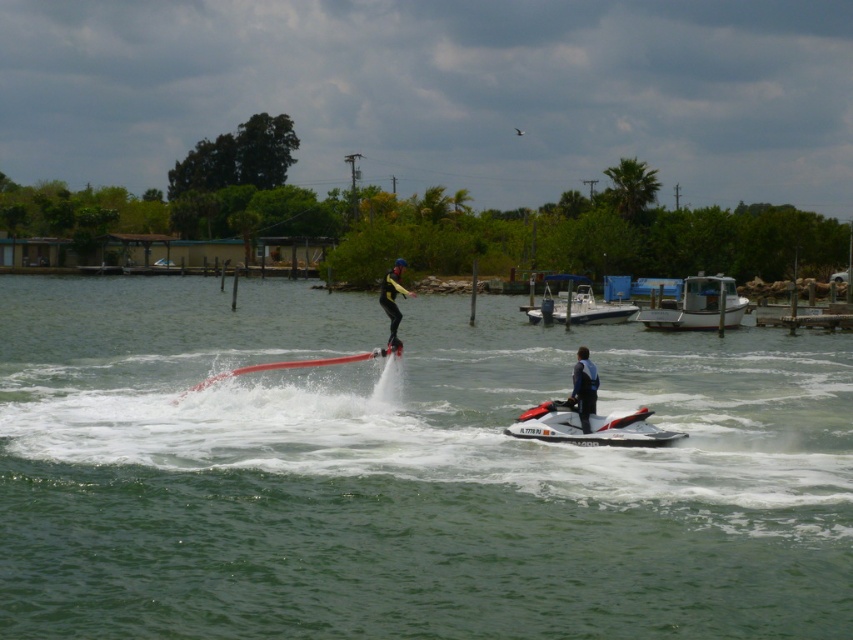
You are a photographer trying to capture the jet skier and the boat in the same frame. Based on the scene, which object should you focus on first to ensure both the white matte boat at right and the yellow matte wetsuit at center are in your shot?

You should focus on the yellow matte wetsuit at center first because the white matte boat at right is positioned to its right side, so centering the yellow matte wetsuit at center will allow the boat to be captured in the frame as well.

You are a photographer standing at the camera position. You want to capture a photo of the white matte boat at right. The boat is 45.16 meters away from you. Your camera has a maximum zoom range of 40 meters. Can you clearly capture the boat without moving closer?

The white matte boat at right is 45.16 meters away from the camera, which exceeds the camera maximum zoom range of 40 meters. Therefore, you cannot clearly capture the boat without moving closer.

You are a drone operator trying to capture a photo of the jet skier performing a trick. The drone is currently at a position where the point at coordinates point (697, 304) is visible. What is the minimum distance the drone must descend to ensure the jet skier is in focus, given the camera has a depth of field of 5 meters?

The point at coordinates point (697, 304) is 49.99 meters away from the camera. To ensure the jet skier is in focus with a depth of field of 5 meters, the drone should descend to within 49.99 meters plus or minus 2.5 meters, so the minimum distance would be 47.49 meters.